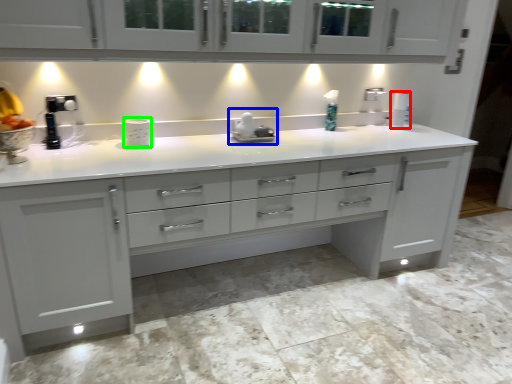
Question: Considering the real-world distances, which object is closest to paper towel (highlighted by a red box)? appliance (highlighted by a blue box) or appliance (highlighted by a green box).

Choices:
 (A) appliance
 (B) appliance

Answer: (A)